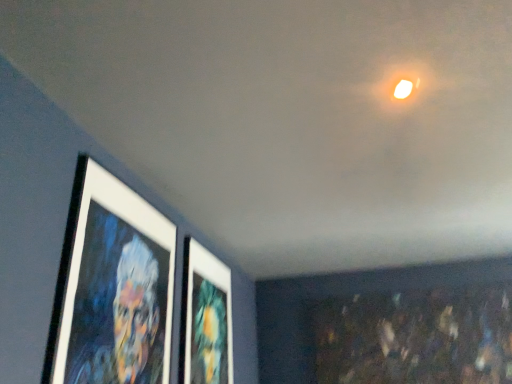
Question: In terms of width, does matte white picture frame at center, placed as the 1th picture frame when sorted from right to left, look wider or thinner when compared to white matte picture frame at left, placed as the second picture frame when sorted from right to left?

Choices:
 (A) wide
 (B) thin

Answer: (A)

Question: Is point (200, 340) positioned closer to the camera than point (138, 231)?

Choices:
 (A) closer
 (B) farther

Answer: (B)

Question: Based on their positions, is matte white picture frame at center, the first picture frame in the back-to-front sequence, located to the left or right of white matte picture frame at left, the 2th picture frame from the back?

Choices:
 (A) left
 (B) right

Answer: (B)

Question: Is white matte picture frame at left, the 2th picture frame from the back, bigger or smaller than matte white picture frame at center, arranged as the 2th picture frame when viewed from the front?

Choices:
 (A) small
 (B) big

Answer: (A)

Question: Is white matte picture frame at left, placed as the second picture frame when sorted from right to left, spatially inside matte white picture frame at center, arranged as the 2th picture frame when viewed from the front, or outside of it?

Choices:
 (A) inside
 (B) outside

Answer: (B)

Question: Is white matte picture frame at left, placed as the second picture frame when sorted from right to left, in front of or behind matte white picture frame at center, arranged as the 2th picture frame when viewed from the front, in the image?

Choices:
 (A) front
 (B) behind

Answer: (A)

Question: Is white matte picture frame at left, placed as the 1th picture frame when sorted from front to back, wider or thinner than matte white picture frame at center, arranged as the 2th picture frame when viewed from the front?

Choices:
 (A) wide
 (B) thin

Answer: (B)